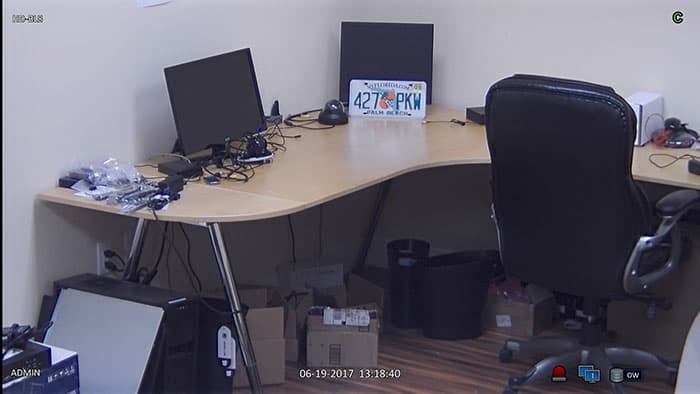
The width and height of the screenshot is (700, 394). What are the coordinates of `computer monitor` in the screenshot? It's located at (220, 84), (386, 59).